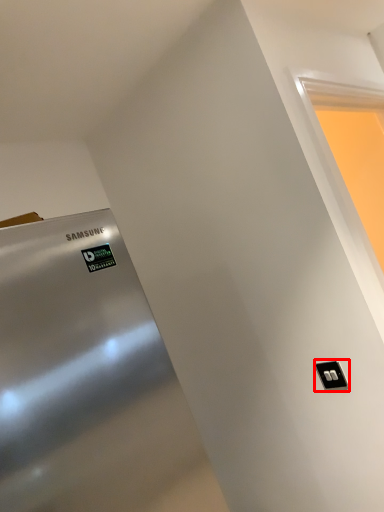
Question: From the image's perspective, what is the correct spatial relationship of light switch (annotated by the red box) in relation to window?

Choices:
 (A) above
 (B) below

Answer: (B)